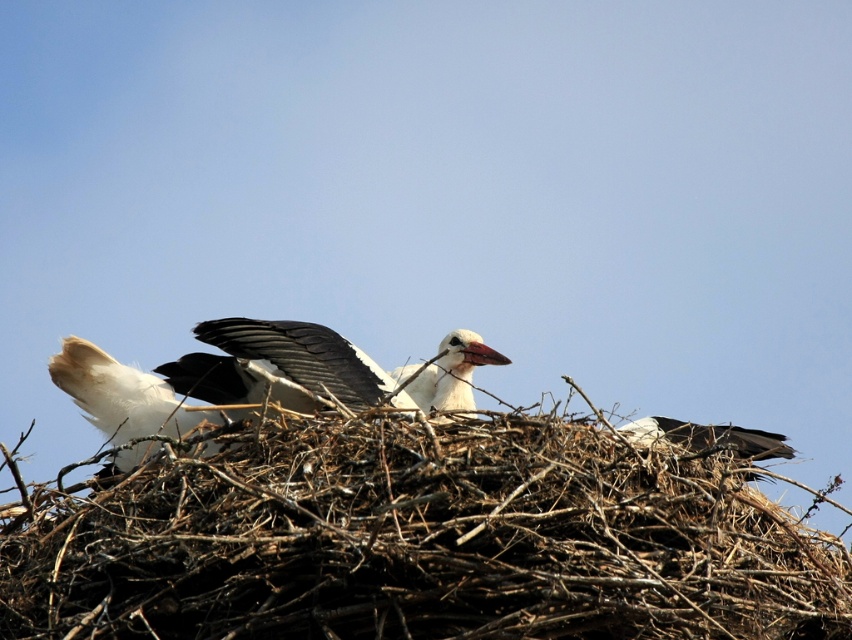
Question: Does brown twigs nest at center have a larger size compared to white matte bird at center?

Choices:
 (A) no
 (B) yes

Answer: (A)

Question: Among these points, which one is nearest to the camera?

Choices:
 (A) (176, 596)
 (B) (272, 330)

Answer: (A)

Question: Can you confirm if brown twigs nest at center is positioned above white matte bird at center?

Choices:
 (A) no
 (B) yes

Answer: (A)

Question: Which point is closer to the camera?

Choices:
 (A) brown twigs nest at center
 (B) white matte bird at center

Answer: (A)

Question: Considering the relative positions of brown twigs nest at center and white matte bird at center in the image provided, where is brown twigs nest at center located with respect to white matte bird at center?

Choices:
 (A) right
 (B) left

Answer: (A)